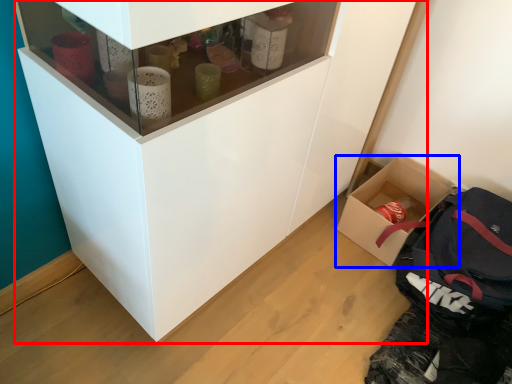
Question: Which point is closer to the camera, cupboard (highlighted by a red box) or box (highlighted by a blue box)?

Choices:
 (A) cupboard
 (B) box

Answer: (A)